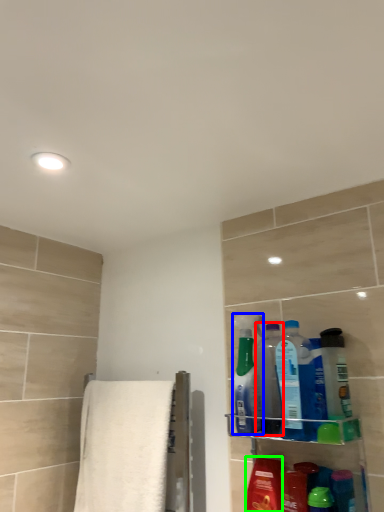
Question: Which is farther away from cleaning product (highlighted by a red box)? cleaning product (highlighted by a blue box) or mouthwash (highlighted by a green box)?

Choices:
 (A) cleaning product
 (B) mouthwash

Answer: (B)